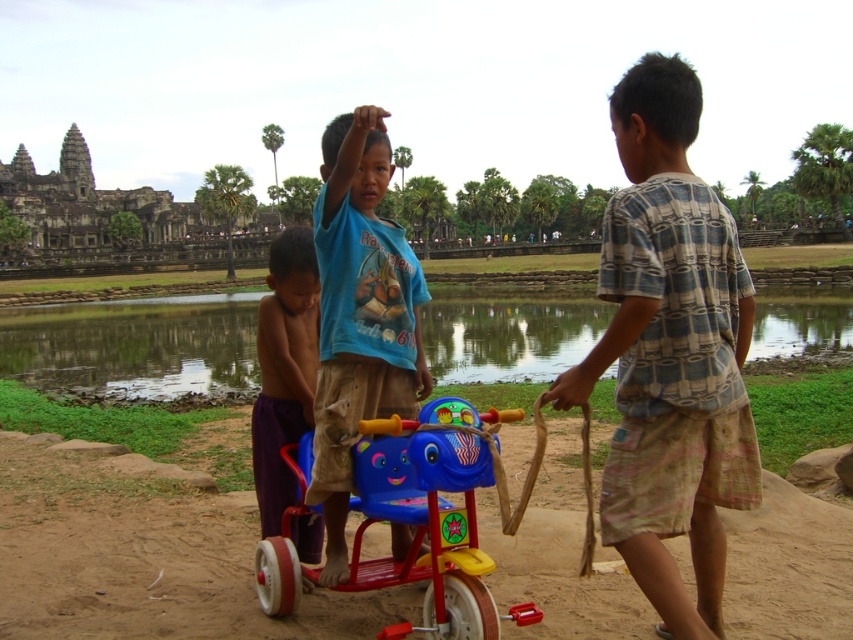
Question: Which object is positioned closest to the brown dirt field at center?

Choices:
 (A) green reflective water at center
 (B) blue plastic tricycle at center
 (C) purple cotton shorts at lower left
 (D) plaid cotton shirt at right

Answer: (B)

Question: Which object is the closest to the plaid cotton shirt at right?

Choices:
 (A) purple cotton shorts at lower left
 (B) blue plastic tricycle at center
 (C) brown dirt field at center

Answer: (B)

Question: Does plaid cotton shirt at right come in front of green reflective water at center?

Choices:
 (A) yes
 (B) no

Answer: (A)

Question: Is green reflective water at center further to the viewer compared to blue cotton shirt at center?

Choices:
 (A) yes
 (B) no

Answer: (A)

Question: Estimate the real-world distances between objects in this image. Which object is farther from the blue plastic tricycle at center?

Choices:
 (A) purple cotton shorts at lower left
 (B) brown dirt field at center
 (C) blue cotton shirt at center
 (D) plaid cotton shirt at right

Answer: (D)

Question: Where is blue cotton shirt at center located in relation to purple cotton shorts at lower left in the image?

Choices:
 (A) below
 (B) above

Answer: (B)